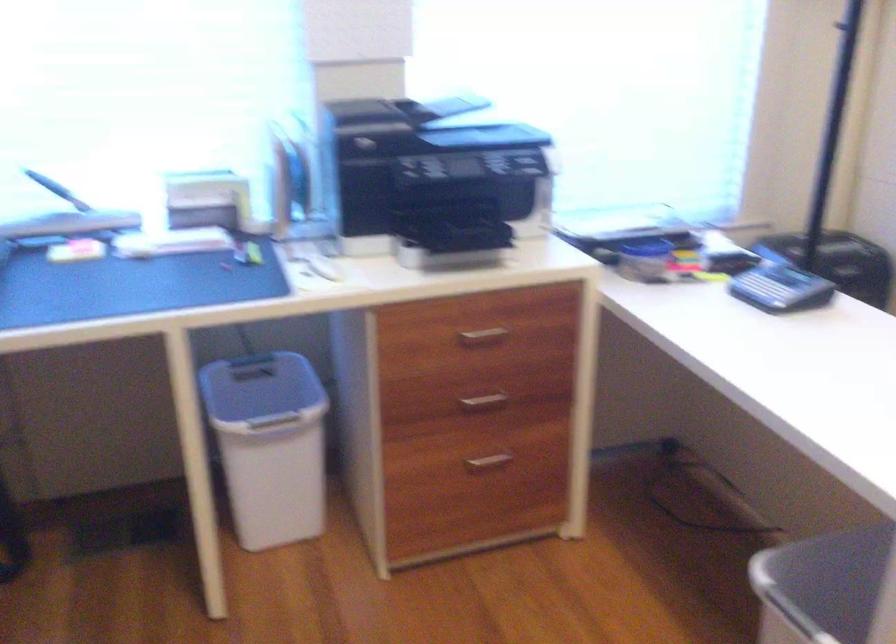
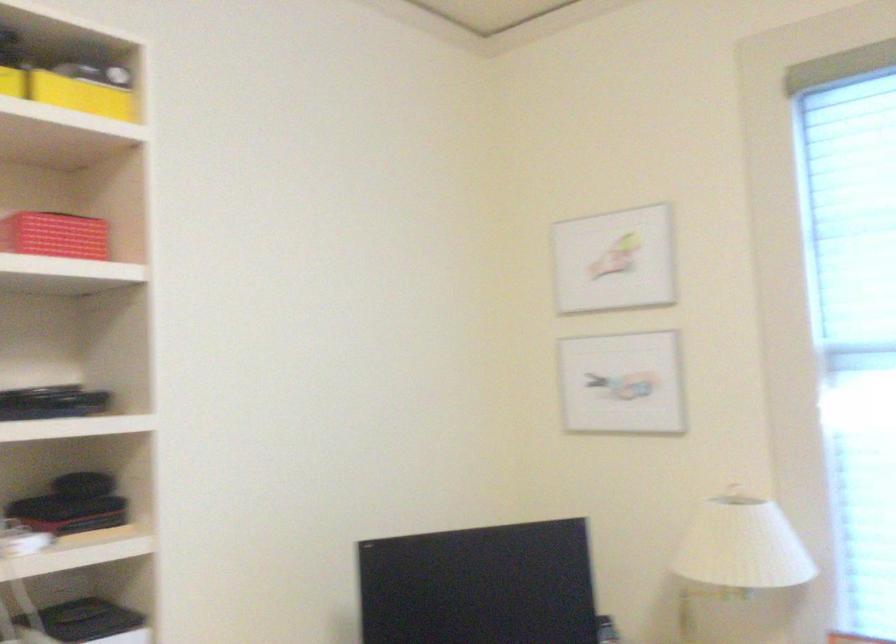
The images are taken continuously from a first-person perspective. In which direction is your viewpoint rotating?

The rotation direction of the camera is left-up.